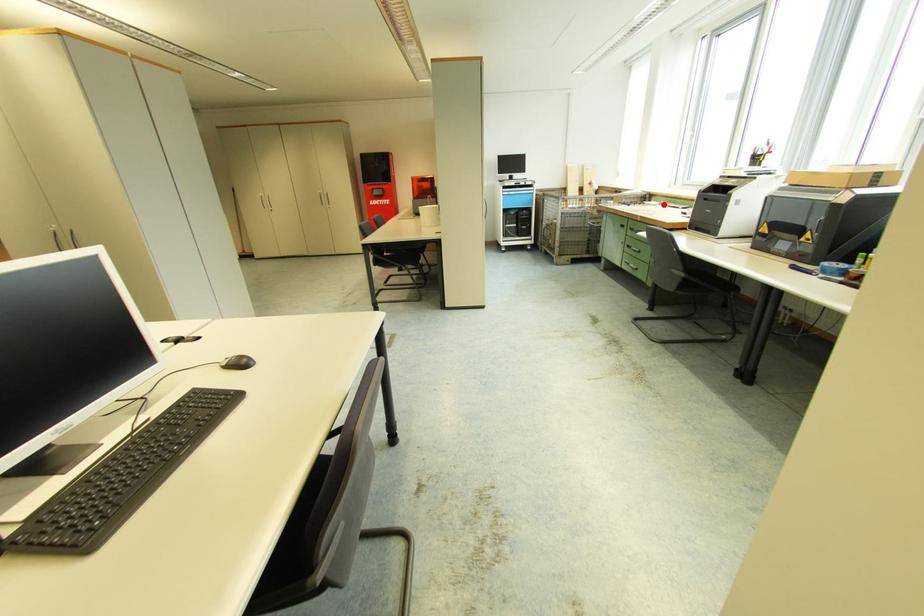
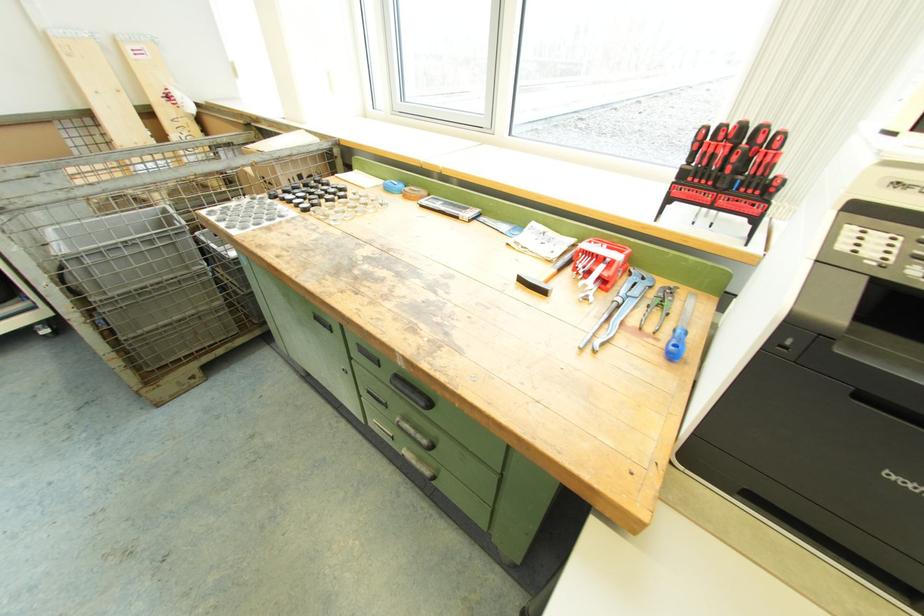
Locate, in the second image, the point that corresponds to the highlighted location in the first image.

(391, 188)